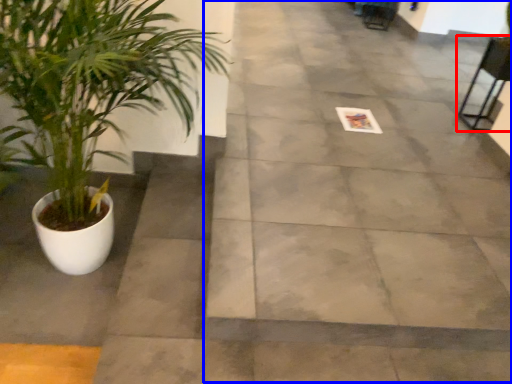
Question: Which object is closer to the camera taking this photo, chair (highlighted by a red box) or pavement (highlighted by a blue box)?

Choices:
 (A) chair
 (B) pavement

Answer: (B)